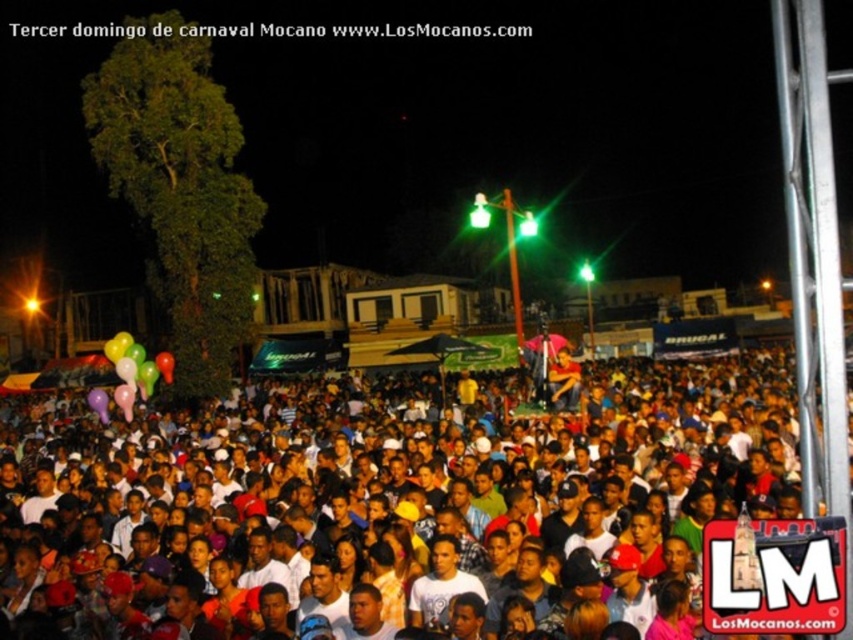
You are standing at the carnival and want to take a photo of both the point at location (x=387, y=634) and the point at (x=161, y=356). Which point should you focus on first to ensure both are in the frame?

You should focus on point (x=387, y=634) first because it is closer to you than point (x=161, y=356), ensuring both points will be in the frame.

You are at the carnival and want to take a photo of both the multicolored balloons at lower center and the rubber balloons at lower left. Which balloon group should you focus on first to ensure both are in the frame?

You should focus on the rubber balloons at lower left first because the multicolored balloons at lower center is positioned on the right side of it, so centering the rubber balloons at lower left will allow the multicolored balloons at lower center to be included in the frame to the right.

You are at the carnival and want to take a photo of both the multicolored balloons at lower center and the rubber balloons at lower left. Which set of balloons should you focus on first if you want to include both in your shot without zooming in or out?

You should focus on the multicolored balloons at lower center first because it is bigger than the rubber balloons at lower left, so capturing it first ensures it fits in the frame before adjusting for the smaller one.